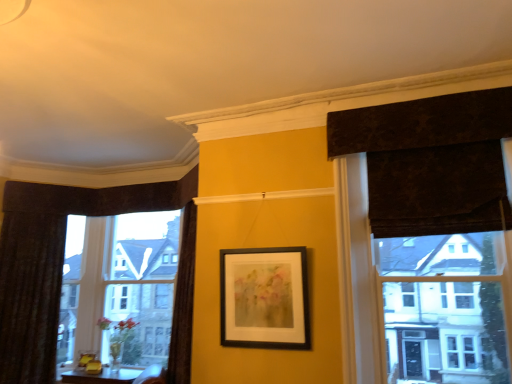
What do you see at coordinates (265, 298) in the screenshot? This screenshot has width=512, height=384. I see `black matte picture frame at center` at bounding box center [265, 298].

Find the location of a particular element. velvet dark brown curtain at left, which appears as the first curtain when viewed from the left is located at coordinates (30, 295).

Which object is wider, black matte picture frame at center or clear glass window at left?

clear glass window at left is wider.

Could you tell me if black matte picture frame at center is turned towards clear glass window at left?

No, black matte picture frame at center does not turn towards clear glass window at left.

At what (x,y) coordinates should I click in order to perform the action: click on window that appears on the left of black matte picture frame at center. Please return your answer as a coordinate pair (x, y). This screenshot has width=512, height=384. Looking at the image, I should click on (121, 291).

How many degrees apart are the facing directions of black matte picture frame at center and clear glass window at left?

2.6 degrees.

Is dark textured curtain at upper right, the second curtain in the back-to-front sequence, completely or partially outside of clear glass window at left?

Yes, dark textured curtain at upper right, the second curtain in the back-to-front sequence, is located beyond the bounds of clear glass window at left.

From their relative heights in the image, would you say dark textured curtain at upper right, the second curtain when ordered from left to right, is taller or shorter than clear glass window at left?

Considering their sizes, dark textured curtain at upper right, the second curtain when ordered from left to right, has less height than clear glass window at left.

Which object is positioned more to the right, dark textured curtain at upper right, the second curtain in the back-to-front sequence, or clear glass window at left?

From the viewer's perspective, dark textured curtain at upper right, the second curtain in the back-to-front sequence, appears more on the right side.

Is point (454, 184) positioned before point (133, 303)?

Yes, it is in front of point (133, 303).

Who is smaller, clear glass window at left or dark textured curtain at upper right, the second curtain in the back-to-front sequence?

Smaller between the two is dark textured curtain at upper right, the second curtain in the back-to-front sequence.

Which object is wider, clear glass window at left or dark textured curtain at upper right, the second curtain in the back-to-front sequence?

With larger width is dark textured curtain at upper right, the second curtain in the back-to-front sequence.

How many degrees apart are the facing directions of clear glass window at left and dark textured curtain at upper right, positioned as the 1th curtain in right-to-left order?

clear glass window at left and dark textured curtain at upper right, positioned as the 1th curtain in right-to-left order, are facing 1.97 degrees away from each other.

Which is further, (120, 248) or (501, 171)?

Positioned behind is point (120, 248).

Which is further, (x=131, y=351) or (x=39, y=246)?

The point (x=131, y=351) is more distant.

Is clear glass window at left wider or thinner than velvet dark brown curtain at left, which is counted as the first curtain, starting from the back?

In the image, clear glass window at left appears to be wider than velvet dark brown curtain at left, which is counted as the first curtain, starting from the back.

Looking at this image, considering their positions, is clear glass window at left located in front of or behind velvet dark brown curtain at left, which is counted as the first curtain, starting from the back?

Clearly, clear glass window at left is behind velvet dark brown curtain at left, which is counted as the first curtain, starting from the back.

Does velvet dark brown curtain at left, which is counted as the first curtain, starting from the back, turn towards dark textured curtain at upper right, the second curtain in the back-to-front sequence?

No, velvet dark brown curtain at left, which is counted as the first curtain, starting from the back, is not turned towards dark textured curtain at upper right, the second curtain in the back-to-front sequence.

Looking at the image, does velvet dark brown curtain at left, which appears as the first curtain when viewed from the left, seem bigger or smaller compared to dark textured curtain at upper right, positioned as the 1th curtain in right-to-left order?

In the image, velvet dark brown curtain at left, which appears as the first curtain when viewed from the left, appears to be smaller than dark textured curtain at upper right, positioned as the 1th curtain in right-to-left order.

Is black matte picture frame at center oriented away from dark textured curtain at upper right, the second curtain when ordered from left to right?

black matte picture frame at center is not turned away from dark textured curtain at upper right, the second curtain when ordered from left to right.

From a real-world perspective, is black matte picture frame at center positioned above or below dark textured curtain at upper right, the second curtain when ordered from left to right?

From a real-world perspective, black matte picture frame at center is physically below dark textured curtain at upper right, the second curtain when ordered from left to right.

Between black matte picture frame at center and dark textured curtain at upper right, the second curtain in the back-to-front sequence, which one appears on the right side from the viewer's perspective?

Positioned to the right is dark textured curtain at upper right, the second curtain in the back-to-front sequence.

What's the angular difference between black matte picture frame at center and dark textured curtain at upper right, the first curtain in the front-to-back sequence,'s facing directions?

0.634 degrees.

Is black matte picture frame at center bigger or smaller than velvet dark brown curtain at left, positioned as the second curtain in right-to-left order?

Considering their sizes, black matte picture frame at center takes up less space than velvet dark brown curtain at left, positioned as the second curtain in right-to-left order.

Considering the relative sizes of black matte picture frame at center and velvet dark brown curtain at left, which is counted as the first curtain, starting from the back, in the image provided, is black matte picture frame at center thinner than velvet dark brown curtain at left, which is counted as the first curtain, starting from the back,?

Yes.

Is black matte picture frame at center not near velvet dark brown curtain at left, the second curtain viewed from the front?

Yes, black matte picture frame at center is far from velvet dark brown curtain at left, the second curtain viewed from the front.

Is black matte picture frame at center not within velvet dark brown curtain at left, which appears as the first curtain when viewed from the left?

black matte picture frame at center lies outside velvet dark brown curtain at left, which appears as the first curtain when viewed from the left,'s area.

Locate an element on the screen. window on the left of black matte picture frame at center is located at coordinates click(121, 291).

This screenshot has height=384, width=512. Identify the location of curtain on the right of the clear glass window at left. (430, 158).

Considering their positions, is velvet dark brown curtain at left, positioned as the second curtain in right-to-left order, positioned further to clear glass window at left than black matte picture frame at center?

black matte picture frame at center is positioned further to the anchor clear glass window at left.

Based on their spatial positions, is black matte picture frame at center or velvet dark brown curtain at left, which appears as the first curtain when viewed from the left, closer to dark textured curtain at upper right, positioned as the 1th curtain in right-to-left order?

Among the two, black matte picture frame at center is located nearer to dark textured curtain at upper right, positioned as the 1th curtain in right-to-left order.

Estimate the real-world distances between objects in this image. Which object is closer to clear glass window at left, dark textured curtain at upper right, the second curtain when ordered from left to right, or black matte picture frame at center?

Among the two, black matte picture frame at center is located nearer to clear glass window at left.

Looking at this image, considering their positions, is clear glass window at left positioned further to dark textured curtain at upper right, positioned as the 1th curtain in right-to-left order, than black matte picture frame at center?

The object further to dark textured curtain at upper right, positioned as the 1th curtain in right-to-left order, is clear glass window at left.

Looking at the image, which one is located further to black matte picture frame at center, clear glass window at left or dark textured curtain at upper right, the second curtain when ordered from left to right?

clear glass window at left is further to black matte picture frame at center.

From the image, which object appears to be nearer to black matte picture frame at center, velvet dark brown curtain at left, which appears as the first curtain when viewed from the left, or clear glass window at left?

velvet dark brown curtain at left, which appears as the first curtain when viewed from the left, lies closer to black matte picture frame at center than the other object.

Estimate the real-world distances between objects in this image. Which object is closer to velvet dark brown curtain at left, which appears as the first curtain when viewed from the left, black matte picture frame at center or dark textured curtain at upper right, the first curtain in the front-to-back sequence?

black matte picture frame at center is positioned closer to the anchor velvet dark brown curtain at left, which appears as the first curtain when viewed from the left.

Considering their positions, is velvet dark brown curtain at left, which appears as the first curtain when viewed from the left, positioned further to black matte picture frame at center than dark textured curtain at upper right, positioned as the 1th curtain in right-to-left order?

The object further to black matte picture frame at center is velvet dark brown curtain at left, which appears as the first curtain when viewed from the left.

Locate an element on the screen. This screenshot has width=512, height=384. picture frame between clear glass window at left and dark textured curtain at upper right, the second curtain when ordered from left to right, in the horizontal direction is located at coordinates (265, 298).

The width and height of the screenshot is (512, 384). I want to click on picture frame between velvet dark brown curtain at left, positioned as the second curtain in right-to-left order, and dark textured curtain at upper right, the first curtain in the front-to-back sequence, in the horizontal direction, so click(265, 298).

Find the location of a particular element. The height and width of the screenshot is (384, 512). window situated between velvet dark brown curtain at left, which is counted as the first curtain, starting from the back, and dark textured curtain at upper right, the second curtain when ordered from left to right, from left to right is located at coordinates (121, 291).

This screenshot has width=512, height=384. I want to click on window between velvet dark brown curtain at left, which is counted as the first curtain, starting from the back, and black matte picture frame at center, in the horizontal direction, so click(x=121, y=291).